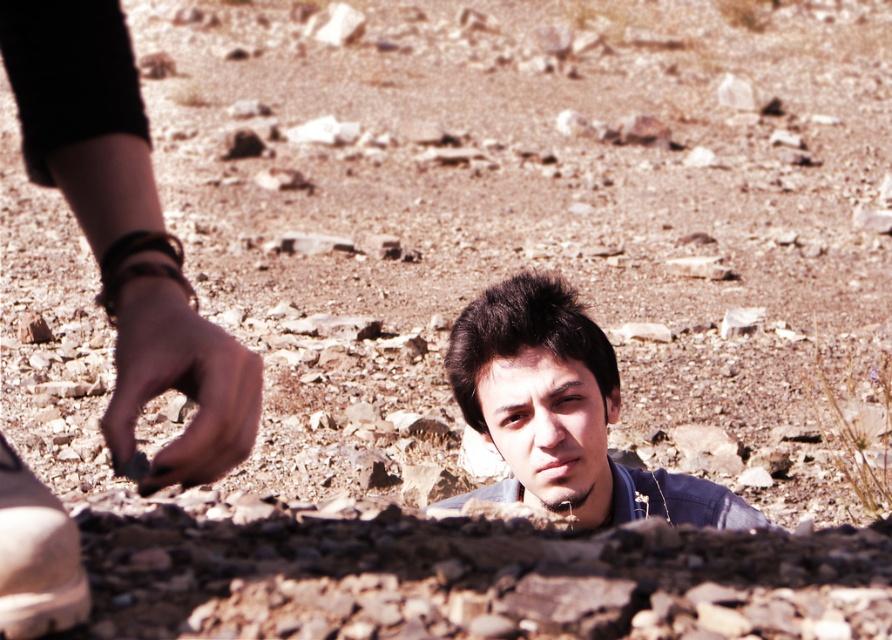
Where is the dark blue shirt at center located in the image?

The dark blue shirt at center is located at point coordinates of 0.645 in the x axis and 0.630 in the y axis.

You are a hiker trying to avoid stepping on a hidden trail. You notice the dark blue shirt at center and the white matte shoe at lower left in your path. What is the minimum distance you need to maintain between your feet to safely step over the gap between these two objects?

The minimum distance you need to maintain between your feet is at least 1.34 meters to safely step over the gap between the dark blue shirt at center and the white matte shoe at lower left, as they are 1.34 meters apart.